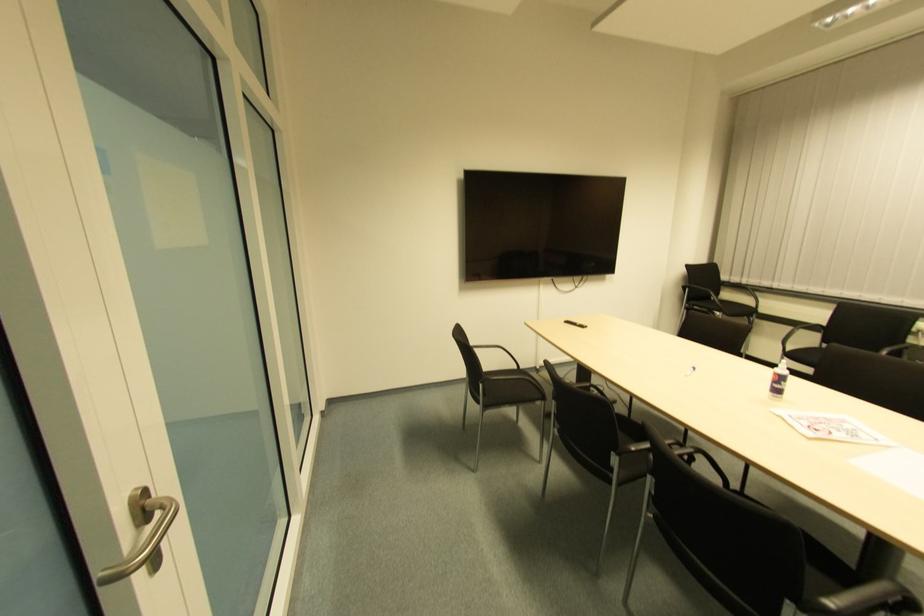
Where is `white marker`? white marker is located at coordinates (690, 371).